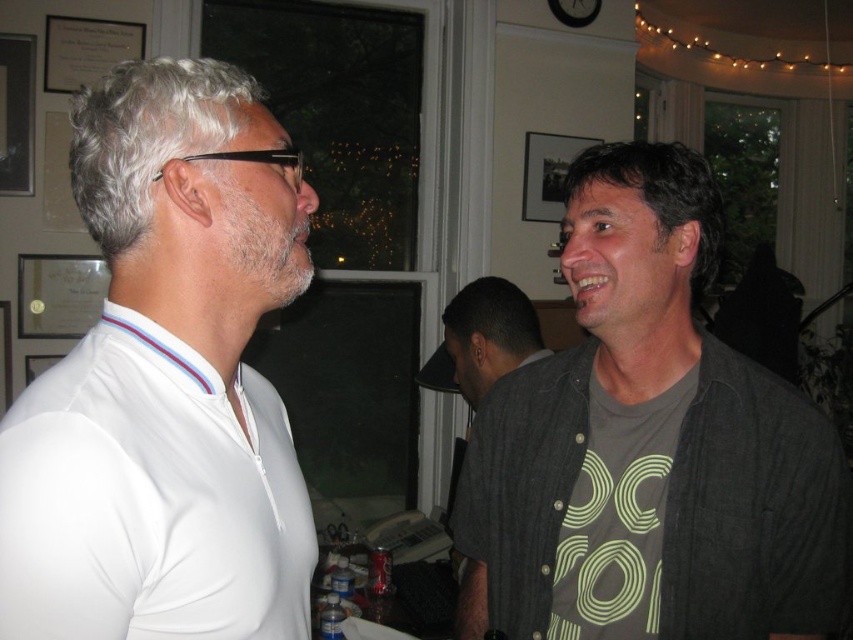
Question: Is white smooth shirt at left below dark gray shirt at center?

Choices:
 (A) yes
 (B) no

Answer: (B)

Question: Among these objects, which one is nearest to the camera?

Choices:
 (A) dark gray shirt at right
 (B) dark gray shirt at center

Answer: (A)

Question: Which point is farther from the camera taking this photo?

Choices:
 (A) (502, 353)
 (B) (619, 525)
 (C) (192, 74)

Answer: (A)

Question: Among these objects, which one is farthest from the camera?

Choices:
 (A) dark gray shirt at center
 (B) dark gray shirt at right

Answer: (A)

Question: Does dark gray shirt at right appear over dark gray shirt at center?

Choices:
 (A) no
 (B) yes

Answer: (A)

Question: Considering the relative positions of white smooth shirt at left and dark gray shirt at center in the image provided, where is white smooth shirt at left located with respect to dark gray shirt at center?

Choices:
 (A) right
 (B) left

Answer: (B)